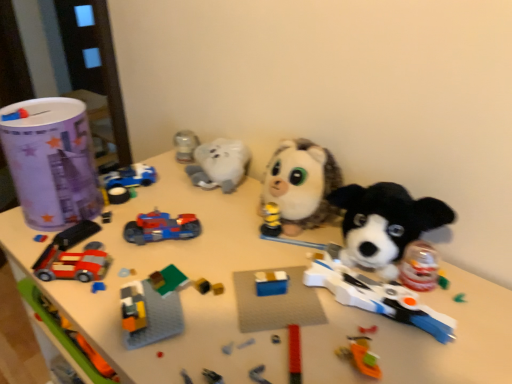
The image size is (512, 384). What are the coordinates of `vacant area that lies between fluffy white plush at center, acting as the 1th toy starting from the right, and brick-like plastic car at lower left, arranged as the 4th toy when viewed from the right` in the screenshot? It's located at (199, 243).